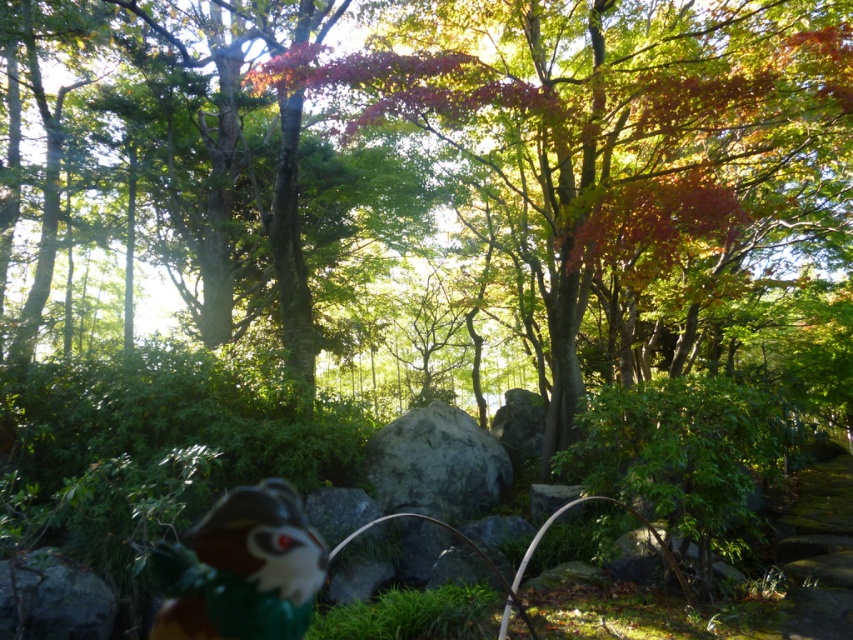
Can you confirm if green leafy tree at center is positioned below brown matte plush toy at lower left?

Actually, green leafy tree at center is above brown matte plush toy at lower left.

Does green leafy tree at center have a greater height compared to brown matte plush toy at lower left?

Correct, green leafy tree at center is much taller as brown matte plush toy at lower left.

Between point (799, 241) and point (195, 532), which one is positioned in front?

Positioned in front is point (195, 532).

Where is `green leafy tree at center`? This screenshot has width=853, height=640. green leafy tree at center is located at coordinates (634, 173).

This screenshot has height=640, width=853. Identify the location of brown matte plush toy at lower left. (241, 570).

Does point (189, 604) come closer to viewer compared to point (403, 492)?

Yes, it is in front of point (403, 492).

The image size is (853, 640). What are the coordinates of `brown matte plush toy at lower left` in the screenshot? It's located at (241, 570).

Is green leafy tree at center below gray rough rock at center?

Actually, green leafy tree at center is above gray rough rock at center.

Is green leafy tree at center taller than gray rough rock at center?

Yes, green leafy tree at center is taller than gray rough rock at center.

Which is in front, point (708, 22) or point (451, 500)?

Point (451, 500)

The image size is (853, 640). Identify the location of green leafy tree at center. (634, 173).